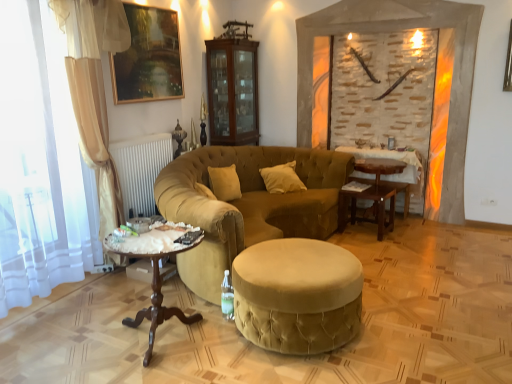
Where is `vacant area that lies between wooden polished table at lower left and velvet gold studio couch at center`? Image resolution: width=512 pixels, height=384 pixels. vacant area that lies between wooden polished table at lower left and velvet gold studio couch at center is located at coordinates (114, 312).